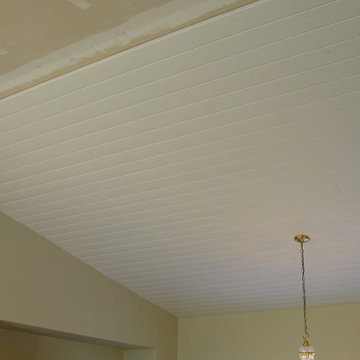
Locate an element on the screen. The width and height of the screenshot is (360, 360). white panelled ceiling is located at coordinates (196, 243).